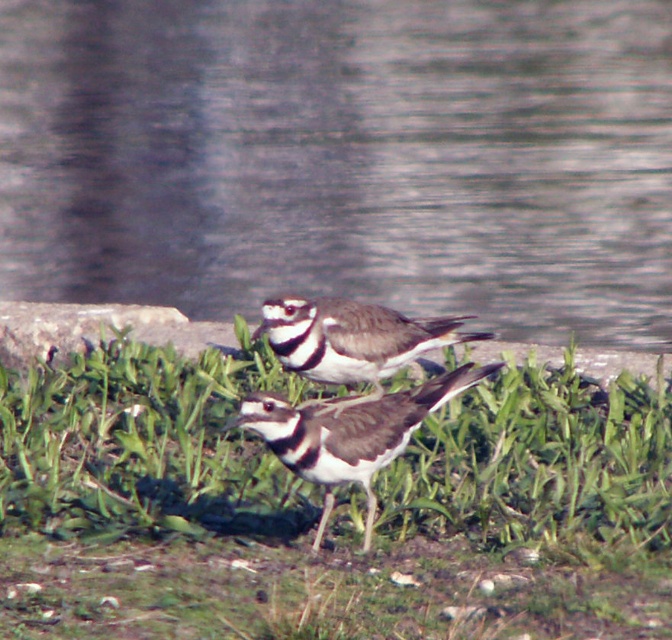
Question: Which object is positioned closest to the black and white speckled bird at center?

Choices:
 (A) smooth water at center
 (B) speckled feathered bird at center

Answer: (B)

Question: Is green grass at center smaller than speckled feathered bird at center?

Choices:
 (A) no
 (B) yes

Answer: (A)

Question: Among these objects, which one is nearest to the camera?

Choices:
 (A) smooth water at center
 (B) speckled feathered bird at center
 (C) black and white speckled bird at center

Answer: (C)

Question: Does smooth water at center have a larger size compared to speckled feathered bird at center?

Choices:
 (A) no
 (B) yes

Answer: (B)

Question: Is the position of green grass at center more distant than that of speckled feathered bird at center?

Choices:
 (A) yes
 (B) no

Answer: (B)

Question: Which point is farther from the camera taking this photo?

Choices:
 (A) [462, 504]
 (B) [427, 394]
 (C) [403, 122]
 (D) [290, 321]

Answer: (C)